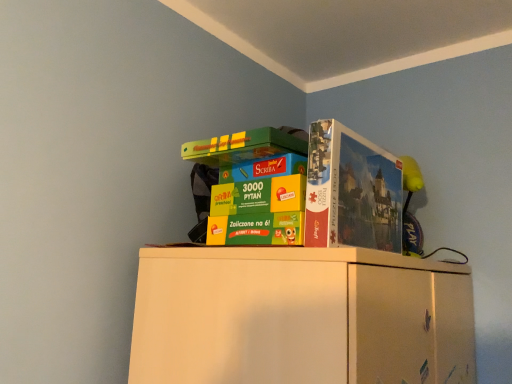
Question: Considering their positions, is matte cardboard puzzle box at upper right located in front of or behind multicolored cardboard boxes at upper center?

Choices:
 (A) front
 (B) behind

Answer: (B)

Question: Is matte cardboard puzzle box at upper right wider or thinner than multicolored cardboard boxes at upper center?

Choices:
 (A) thin
 (B) wide

Answer: (A)

Question: From a real-world perspective, is matte cardboard puzzle box at upper right physically located above or below multicolored cardboard boxes at upper center?

Choices:
 (A) above
 (B) below

Answer: (A)

Question: From the image's perspective, is multicolored cardboard boxes at upper center positioned above or below matte cardboard puzzle box at upper right?

Choices:
 (A) below
 (B) above

Answer: (A)

Question: Relative to matte cardboard puzzle box at upper right, is multicolored cardboard boxes at upper center in front or behind?

Choices:
 (A) behind
 (B) front

Answer: (B)

Question: In the image, is multicolored cardboard boxes at upper center on the left side or the right side of matte cardboard puzzle box at upper right?

Choices:
 (A) right
 (B) left

Answer: (B)

Question: Do you think multicolored cardboard boxes at upper center is within matte cardboard puzzle box at upper right, or outside of it?

Choices:
 (A) inside
 (B) outside

Answer: (B)